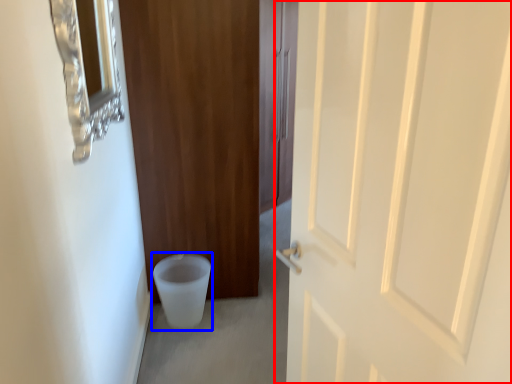
Question: Which object is further to the camera taking this photo, door (highlighted by a red box) or toilet bowl (highlighted by a blue box)?

Choices:
 (A) door
 (B) toilet bowl

Answer: (B)